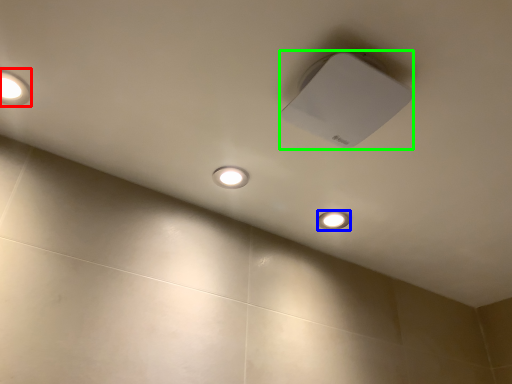
Question: Based on their relative distances, which object is farther from lamp (highlighted by a red box)? Choose from dot (highlighted by a blue box) and lamp (highlighted by a green box).

Choices:
 (A) dot
 (B) lamp

Answer: (A)